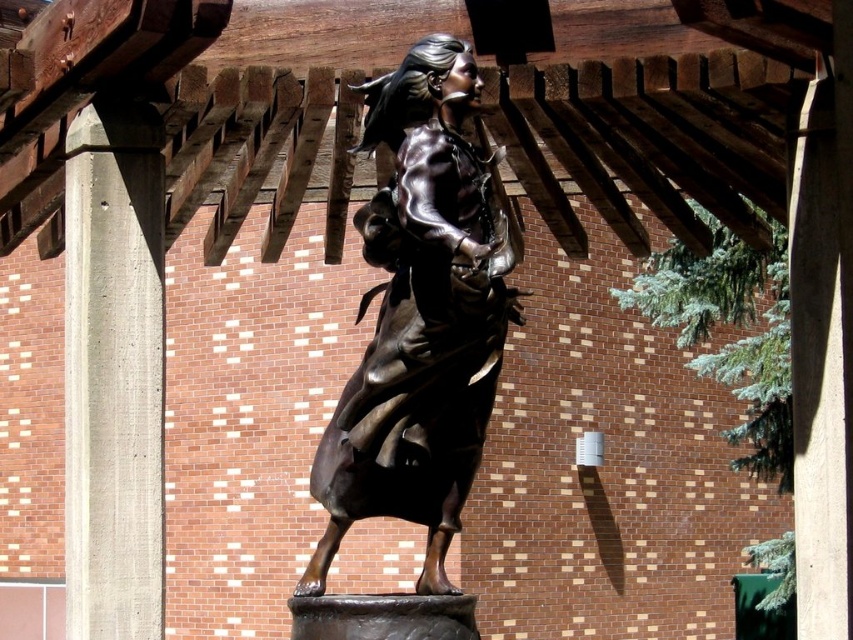
Question: Does shiny bronze statue at center appear on the left side of gray concrete pillar at left?

Choices:
 (A) yes
 (B) no

Answer: (B)

Question: Among these points, which one is nearest to the camera?

Choices:
 (A) (99, 531)
 (B) (469, 88)

Answer: (A)

Question: Can you confirm if shiny bronze statue at center is smaller than gray concrete pillar at left?

Choices:
 (A) no
 (B) yes

Answer: (B)

Question: Which point is closer to the camera?

Choices:
 (A) gray concrete pillar at left
 (B) shiny bronze statue at center

Answer: (B)

Question: Can you confirm if shiny bronze statue at center is wider than gray concrete pillar at left?

Choices:
 (A) yes
 (B) no

Answer: (B)